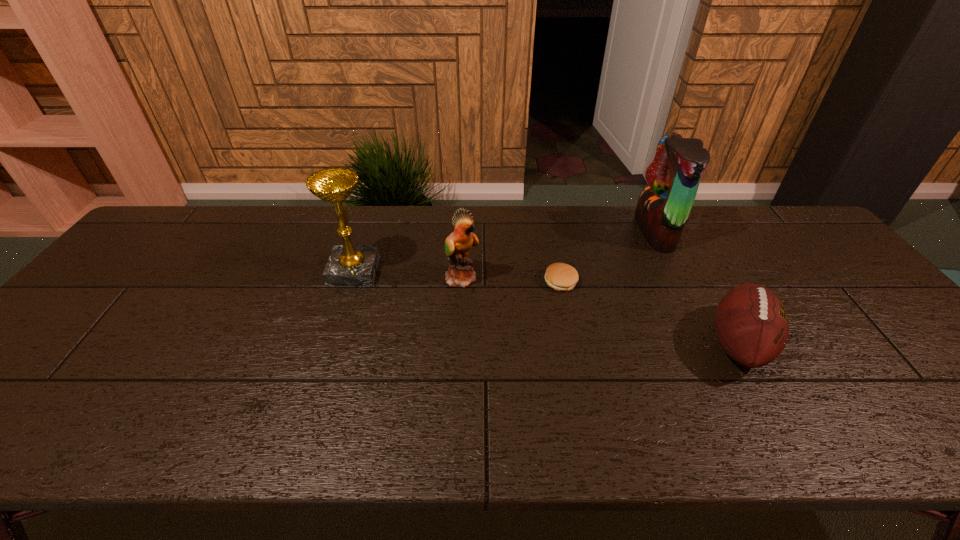
You are a GUI agent. You are given a task and a screenshot of the screen. Output one action in this format:
    pyautogui.click(x=<x>, y=<y>)
    Task: Click on the farther parrot
    The width and height of the screenshot is (960, 540).
    Given the screenshot: What is the action you would take?
    pyautogui.click(x=663, y=207)

You are a GUI agent. You are given a task and a screenshot of the screen. Output one action in this format:
    pyautogui.click(x=<x>, y=<y>)
    Task: Click on the right parrot
    The width and height of the screenshot is (960, 540).
    Given the screenshot: What is the action you would take?
    pyautogui.click(x=663, y=207)

The height and width of the screenshot is (540, 960). Identify the location of the leftmost object. (348, 265).

At what (x,y) coordinates should I click in order to perform the action: click on the third tallest object. Please return your answer as a coordinate pair (x, y). The width and height of the screenshot is (960, 540). Looking at the image, I should click on click(460, 273).

At what (x,y) coordinates should I click in order to perform the action: click on the left parrot. Please return your answer as a coordinate pair (x, y). Looking at the image, I should click on (460, 273).

Identify the location of the fourth tallest object. The image size is (960, 540). [751, 323].

At what (x,y) coordinates should I click in order to perform the action: click on football (American). Please return your answer as a coordinate pair (x, y). This screenshot has height=540, width=960. Looking at the image, I should click on (751, 323).

The width and height of the screenshot is (960, 540). Identify the location of the third object from left to right. (560, 276).

At what (x,y) coordinates should I click in order to perform the action: click on the shortest object. Please return your answer as a coordinate pair (x, y). The width and height of the screenshot is (960, 540). Looking at the image, I should click on (560, 276).

At what (x,y) coordinates should I click in order to perform the action: click on vacant area situated 0.210m at the face of the right parrot. Please return your answer as a coordinate pair (x, y). Looking at the image, I should click on (573, 232).